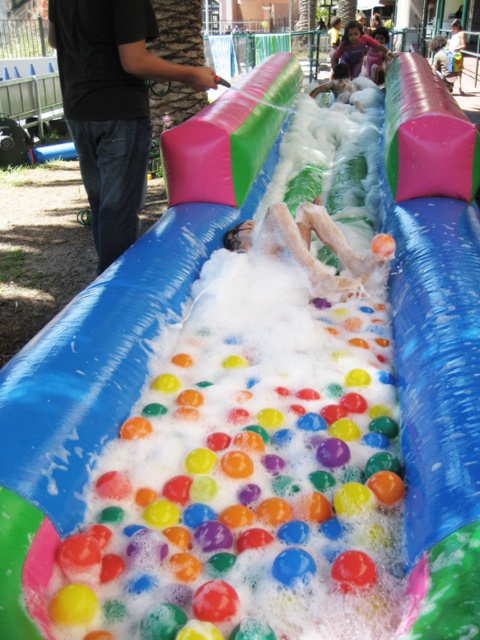
You are standing near the black jeans at left and want to take a photo of the person sliding down the slide. Your camera is 2.53 meters away from the black jeans. Is the camera within reach to take the photo without moving from your current position?

The camera is 2.53 meters away from the black jeans at left, so it is within reach to take the photo without moving from your current position.